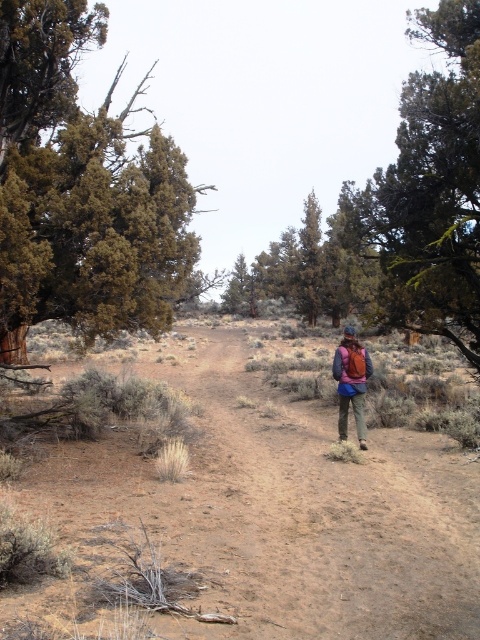
Is point (112, 234) closer to viewer compared to point (249, 308)?

Yes, point (112, 234) is closer to viewer.

Is green textured tree at left above green textured tree at center?

Yes, green textured tree at left is above green textured tree at center.

Describe the element at coordinates (81, 189) in the screenshot. I see `green textured tree at left` at that location.

The image size is (480, 640). In order to click on green textured tree at left in this screenshot , I will do `click(81, 189)`.

Is green textured tree at left to the right of green textured tree at right from the viewer's perspective?

In fact, green textured tree at left is to the left of green textured tree at right.

Looking at this image, is green textured tree at left taller than green textured tree at right?

In fact, green textured tree at left may be shorter than green textured tree at right.

I want to click on green textured tree at left, so click(81, 189).

Between brown dirt track at center and green textured tree at right, which one has less height?

Standing shorter between the two is brown dirt track at center.

Who is more forward, (477, 525) or (471, 188)?

Point (477, 525)

Is point (113, 445) closer to viewer compared to point (408, 88)?

Yes.

This screenshot has width=480, height=640. Identify the location of brown dirt track at center. (285, 515).